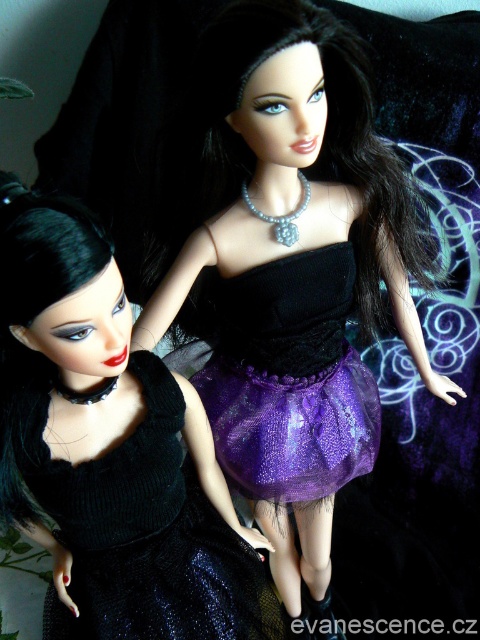
You are a fashion designer who needs to choose between the matte black dress at center and the black velvet dress at left for a runway show. Considering their sizes, which dress would require a larger stage space to display its details properly?

The matte black dress at center has a larger size compared to the black velvet dress at left, so it would require a larger stage space to display its details properly.

You are a fashion designer who wants to create a coordinated outfit using both the matte black dress at center and the purple tulle skirt at center. Which garment should you use as the base for the outfit to ensure proper proportion and balance?

The matte black dress at center is larger in size than the purple tulle skirt at center, so it should be used as the base garment to maintain proportion and balance in the outfit.